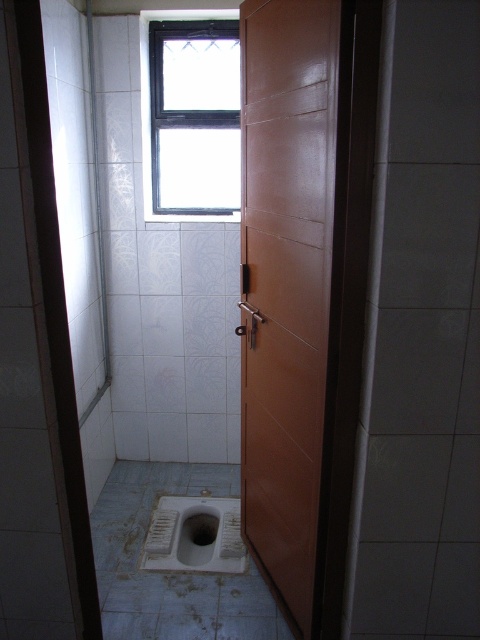
Does point (296, 598) come farther from viewer compared to point (229, 205)?

No.

Which is behind, point (283, 387) or point (190, 160)?

Point (190, 160)

The image size is (480, 640). Find the location of `glossy wood door at center`. glossy wood door at center is located at coordinates [287, 284].

Who is more forward, (x=184, y=195) or (x=181, y=497)?

Point (x=181, y=497)

Which is in front, point (176, 168) or point (216, 508)?

Point (216, 508) is in front.

Where is `clear glass window at upper center`? This screenshot has height=640, width=480. clear glass window at upper center is located at coordinates (193, 116).

Does glossy wood door at center appear on the left side of white matte toilet bowl at center?

Incorrect, glossy wood door at center is not on the left side of white matte toilet bowl at center.

Can you confirm if glossy wood door at center is smaller than white matte toilet bowl at center?

No, glossy wood door at center is not smaller than white matte toilet bowl at center.

In the scene shown: Who is more distant from viewer, [249,243] or [237,532]?

The point [237,532] is behind.

Locate an element on the screen. glossy wood door at center is located at coordinates (287, 284).